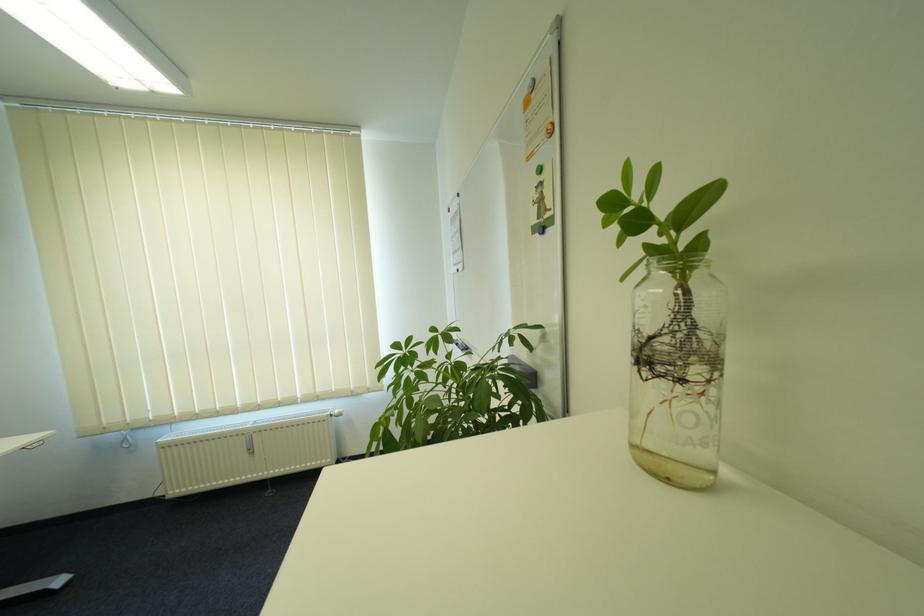
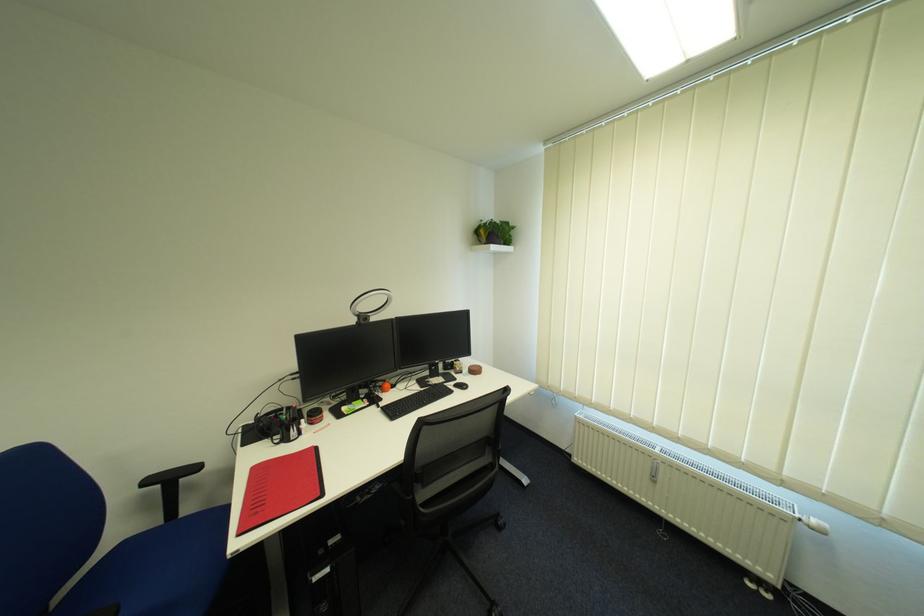
Question: Based on the continuous images, in which direction is the camera rotating? Reply with the corresponding letter.

Choices:
 (A) Left
 (B) Right
 (C) Up
 (D) Down

Answer: (A)